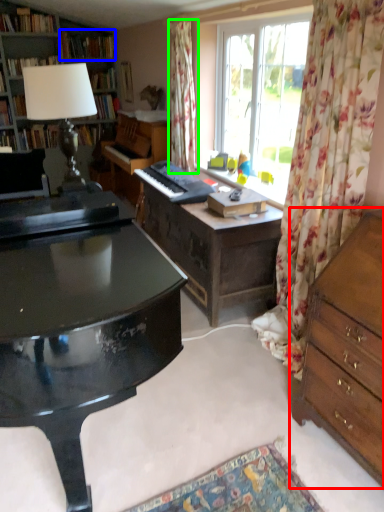
Question: Considering the real-world distances, which object is farthest from chest of drawers (highlighted by a red box)? book (highlighted by a blue box) or curtain (highlighted by a green box)?

Choices:
 (A) book
 (B) curtain

Answer: (A)